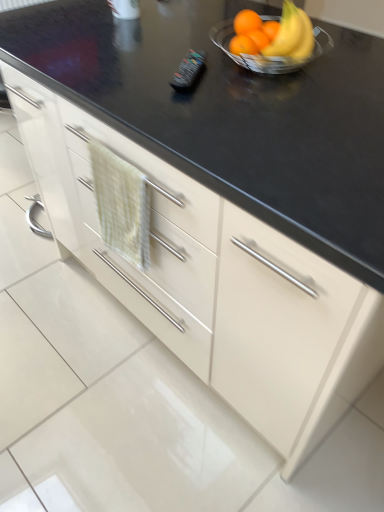
This screenshot has width=384, height=512. Find the location of `free point behind black plastic remote control at center`. free point behind black plastic remote control at center is located at coordinates (184, 46).